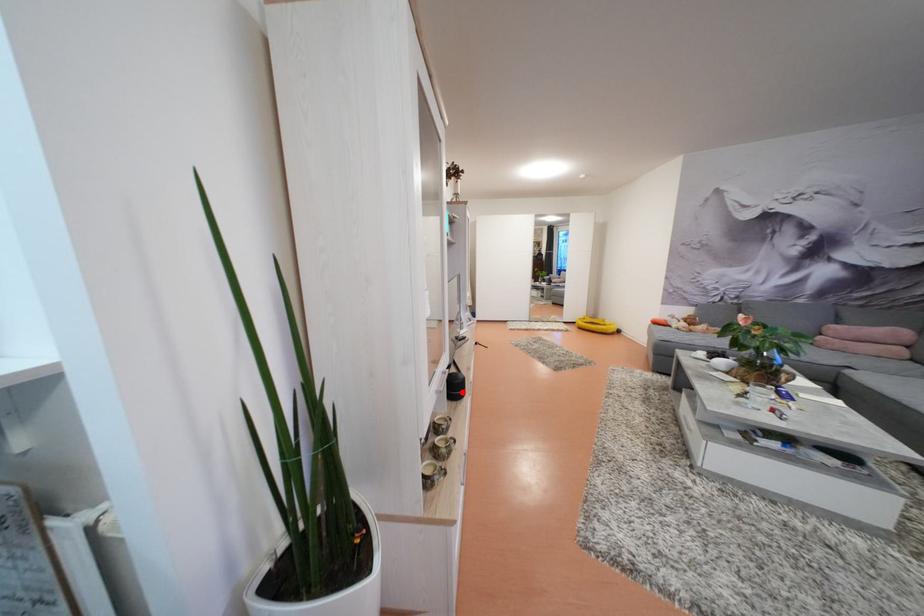
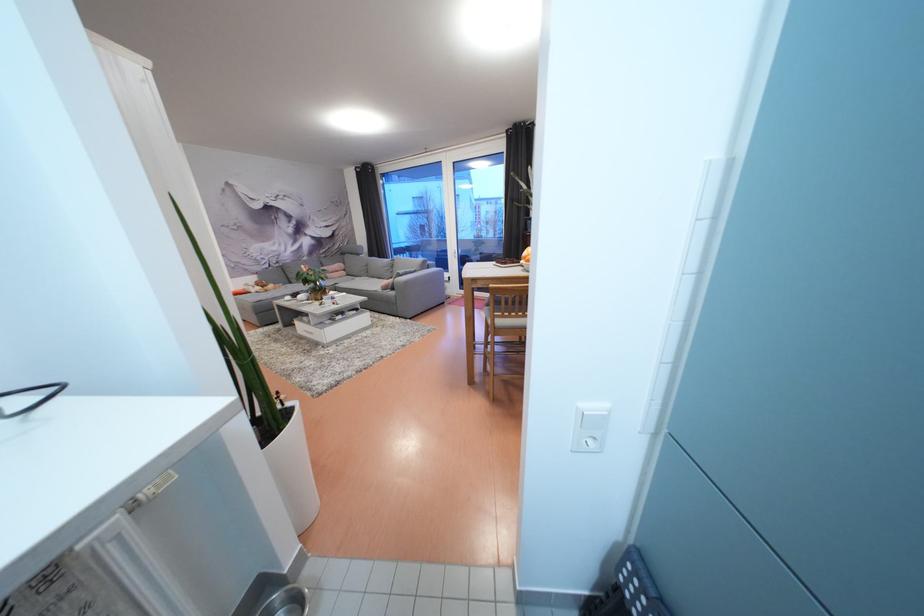
Question: I am providing you with two images of the same scene from different viewpoints. A red point is marked on the first image. Is the red point's position out of view in image 2?

Choices:
 (A) Yes
 (B) No

Answer: (A)